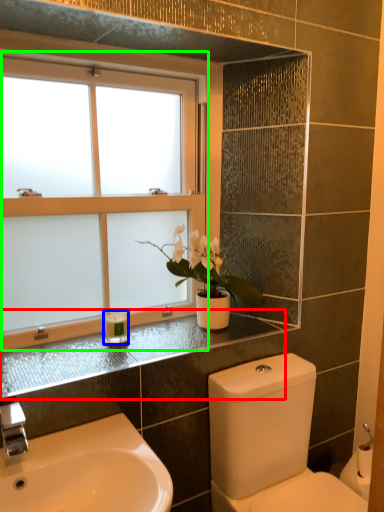
Question: Considering the real-world distances, which object is farthest from counter top (highlighted by a red box)? toiletry (highlighted by a blue box) or window (highlighted by a green box)?

Choices:
 (A) toiletry
 (B) window

Answer: (B)